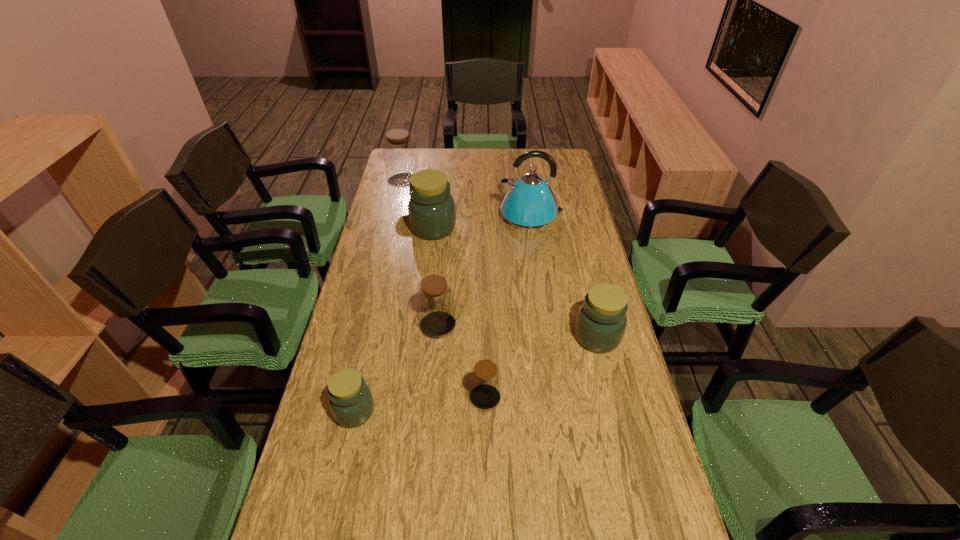
Identify which brown jar is the nearest to the farthest object. Please provide its 2D coordinates. Your answer should be formatted as a tuple, i.e. [(x, y)], where the tuple contains the x and y coordinates of a point satisfying the conditions above.

[(435, 301)]

Choose which green jar is the nearest neighbor to the third object from right to left. Please provide its 2D coordinates. Your answer should be formatted as a tuple, i.e. [(x, y)], where the tuple contains the x and y coordinates of a point satisfying the conditions above.

[(600, 325)]

Identify which green jar is located as the nearest to the kettle. Please provide its 2D coordinates. Your answer should be formatted as a tuple, i.e. [(x, y)], where the tuple contains the x and y coordinates of a point satisfying the conditions above.

[(431, 208)]

This screenshot has height=540, width=960. Find the location of `free location that satisfies the following two spatial constraints: 1. at the spout of the tallest object; 2. on the back side of the rightmost green jar`. free location that satisfies the following two spatial constraints: 1. at the spout of the tallest object; 2. on the back side of the rightmost green jar is located at coordinates tap(547, 337).

Find the location of a particular element. This screenshot has width=960, height=540. vacant space that satisfies the following two spatial constraints: 1. on the back side of the second biggest green jar; 2. on the left side of the leftmost green jar is located at coordinates (372, 337).

The width and height of the screenshot is (960, 540). Find the location of `vacant space that satisfies the following two spatial constraints: 1. at the spout of the tallest object; 2. on the left side of the rightmost green jar`. vacant space that satisfies the following two spatial constraints: 1. at the spout of the tallest object; 2. on the left side of the rightmost green jar is located at coordinates (547, 337).